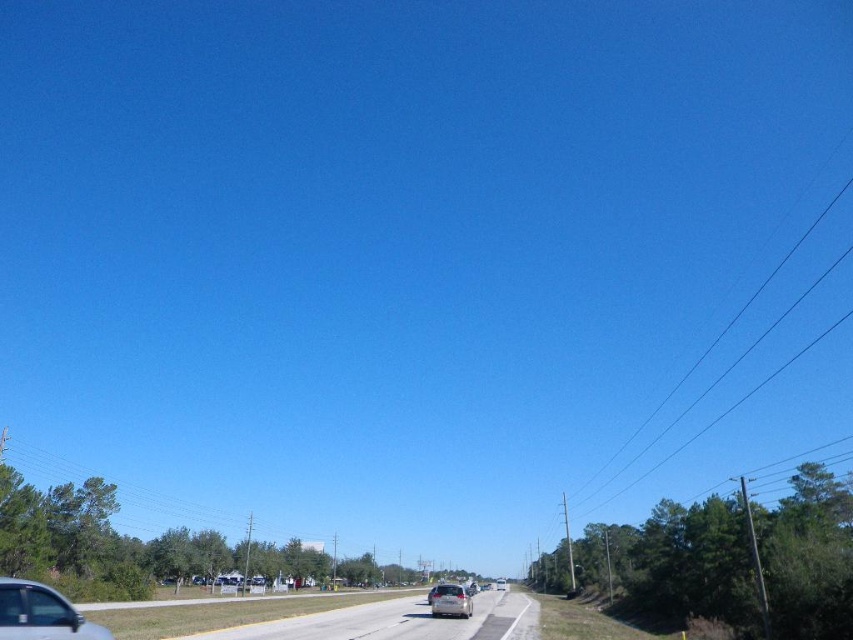
You are a driver approaching the satin silver sedan at center on the gray asphalt highway at center. You need to pass the sedan safely. Is the highway wide enough for you to pass without crossing the dashed yellow line?

The gray asphalt highway at center is located above the satin silver sedan at center, which means the highway is elevated or positioned higher than the sedan. This does not provide information about the highway width. Therefore, it is unclear if the highway is wide enough for safe passing without crossing the dashed yellow line.

In the scene shown: You are driving a car and see the gray asphalt highway at center and the silver metallic car at lower left. Which object is positioned to the right of the other?

The gray asphalt highway at center is positioned to the right of the silver metallic car at lower left.